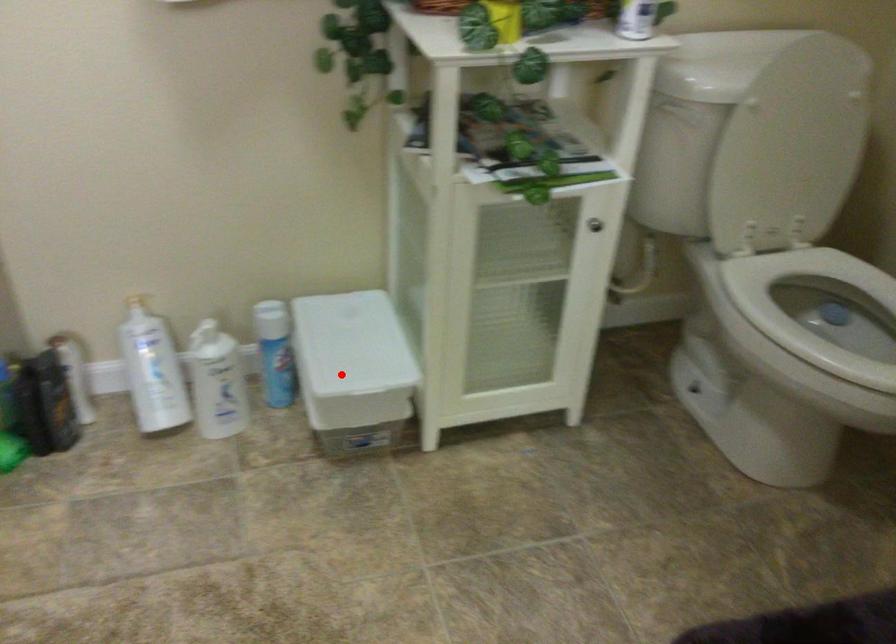
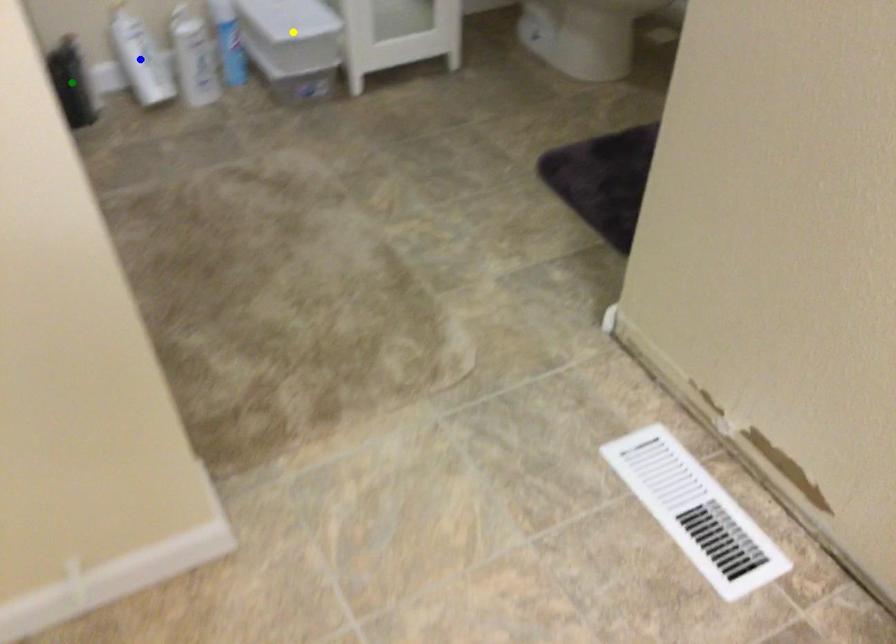
Question: I am providing you with two images of the same scene from different viewpoints. A red point is marked on the first image. You are given multiple points on the second image. In image 2, which mark is for the same physical point as the one in image 1?

Choices:
 (A) blue point
 (B) yellow point
 (C) green point

Answer: (B)